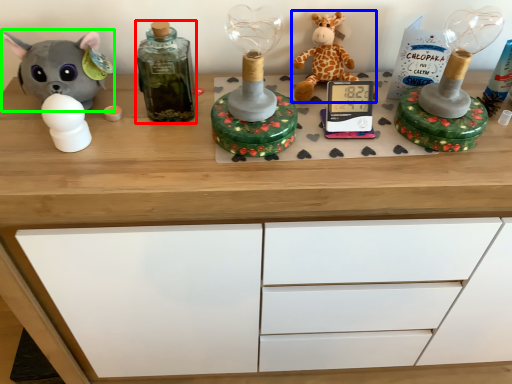
Question: Which is nearer to the bottle (highlighted by a red box)? toy (highlighted by a blue box) or toy (highlighted by a green box).

Choices:
 (A) toy
 (B) toy

Answer: (B)